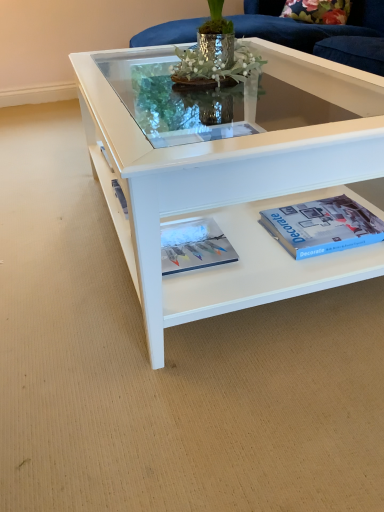
Question: Does blue matte paperback book at lower right touch white glossy coffee table at center?

Choices:
 (A) yes
 (B) no

Answer: (B)

Question: Does blue matte paperback book at lower right have a lesser width compared to white glossy coffee table at center?

Choices:
 (A) yes
 (B) no

Answer: (A)

Question: Is the depth of blue matte paperback book at lower right greater than that of white glossy coffee table at center?

Choices:
 (A) yes
 (B) no

Answer: (A)

Question: Considering the relative sizes of blue matte paperback book at lower right and white glossy coffee table at center in the image provided, is blue matte paperback book at lower right wider than white glossy coffee table at center?

Choices:
 (A) no
 (B) yes

Answer: (A)

Question: From the image's perspective, would you say blue matte paperback book at lower right is positioned over white glossy coffee table at center?

Choices:
 (A) yes
 (B) no

Answer: (B)

Question: Considering the relative sizes of blue matte paperback book at lower right and white glossy coffee table at center in the image provided, is blue matte paperback book at lower right bigger than white glossy coffee table at center?

Choices:
 (A) yes
 (B) no

Answer: (B)

Question: Would you say matte white magazine at center is part of white glossy coffee table at center's contents?

Choices:
 (A) no
 (B) yes

Answer: (A)

Question: Is white glossy coffee table at center facing towards matte white magazine at center?

Choices:
 (A) yes
 (B) no

Answer: (A)

Question: From a real-world perspective, is white glossy coffee table at center below matte white magazine at center?

Choices:
 (A) yes
 (B) no

Answer: (B)

Question: Does white glossy coffee table at center have a smaller size compared to matte white magazine at center?

Choices:
 (A) no
 (B) yes

Answer: (A)

Question: From a real-world perspective, is white glossy coffee table at center over matte white magazine at center?

Choices:
 (A) yes
 (B) no

Answer: (A)

Question: Can you confirm if white glossy coffee table at center is positioned to the left of matte white magazine at center?

Choices:
 (A) no
 (B) yes

Answer: (A)

Question: Is matte white magazine at center turned away from blue matte paperback book at lower right?

Choices:
 (A) yes
 (B) no

Answer: (A)